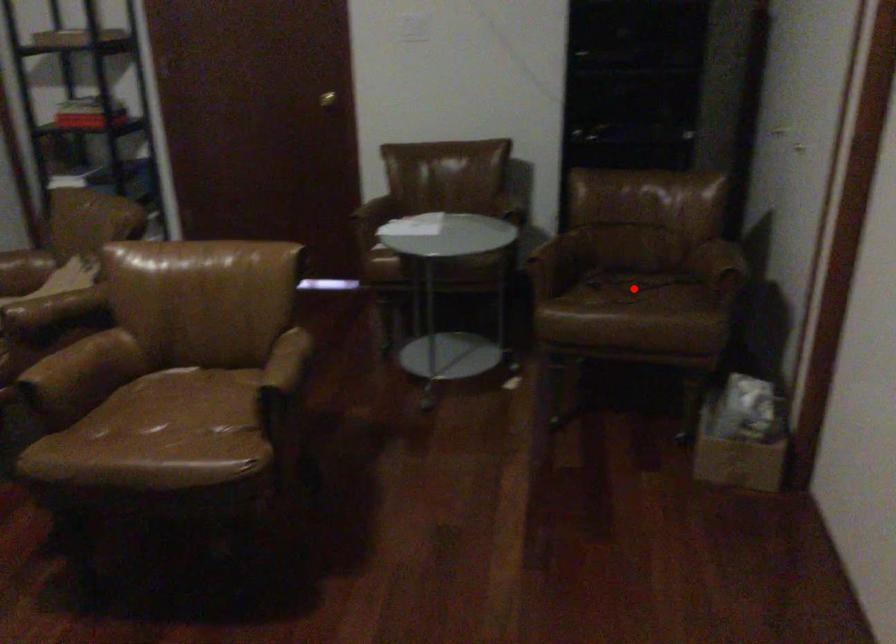
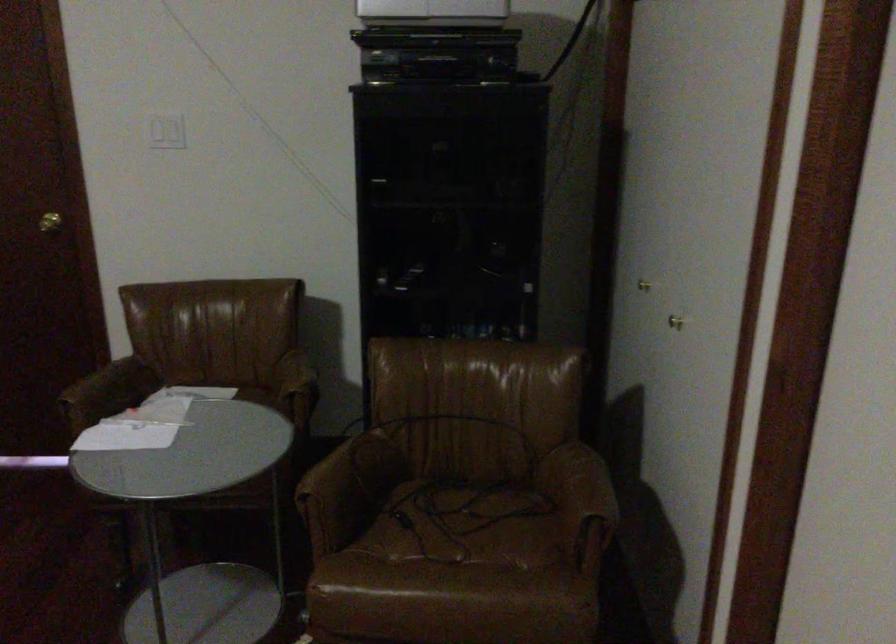
Locate, in the second image, the point that corresponds to the highlighted location in the first image.

(464, 525)